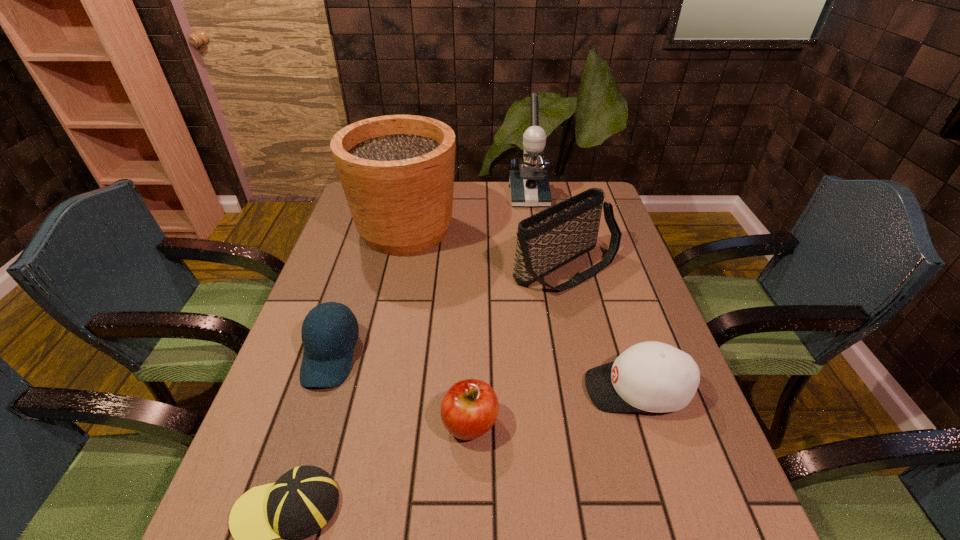
Select which baseball cap is the closest to the shortest baseball cap. Please provide its 2D coordinates. Your answer should be formatted as a tuple, i.e. [(x, y)], where the tuple contains the x and y coordinates of a point satisfying the conditions above.

[(327, 358)]

This screenshot has height=540, width=960. I want to click on free space in the image that satisfies the following two spatial constraints: 1. at the eyepiece of the microscope; 2. on the right side of the handbag, so click(x=540, y=267).

The height and width of the screenshot is (540, 960). Find the location of `vacant area that satisfies the following two spatial constraints: 1. on the back side of the apple; 2. on the left side of the third tallest object`. vacant area that satisfies the following two spatial constraints: 1. on the back side of the apple; 2. on the left side of the third tallest object is located at coordinates (473, 267).